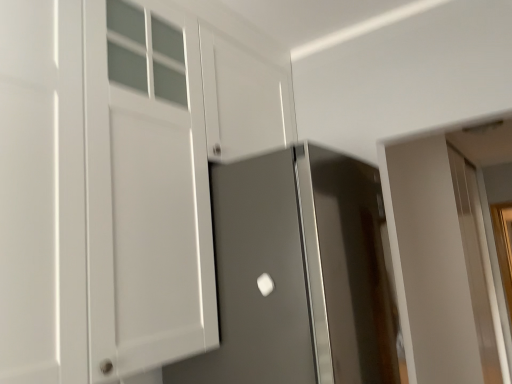
Question: Could you tell me if white matte cabinet at left is turned towards satin gray door at center, positioned as the first door in front-to-back order?

Choices:
 (A) no
 (B) yes

Answer: (A)

Question: Considering the relative sizes of white matte cabinet at left and satin gray door at center, the second door from the right, in the image provided, is white matte cabinet at left wider than satin gray door at center, the second door from the right,?

Choices:
 (A) yes
 (B) no

Answer: (B)

Question: From a real-world perspective, is white matte cabinet at left positioned under satin gray door at center, the second door from the right, based on gravity?

Choices:
 (A) yes
 (B) no

Answer: (B)

Question: Is white matte cabinet at left bigger than satin gray door at center, which is the second door from back to front?

Choices:
 (A) yes
 (B) no

Answer: (B)

Question: From the image's perspective, does white matte cabinet at left appear higher than satin gray door at center, positioned as the first door in front-to-back order?

Choices:
 (A) no
 (B) yes

Answer: (B)

Question: Is white matte cabinet at left located outside satin gray door at center, positioned as the first door in front-to-back order?

Choices:
 (A) yes
 (B) no

Answer: (A)

Question: Is white glossy door at right, which is the second door in front-to-back order, facing away from white matte cabinet at left?

Choices:
 (A) no
 (B) yes

Answer: (A)

Question: Considering the relative sizes of white glossy door at right, the 1th door positioned from the back, and white matte cabinet at left in the image provided, is white glossy door at right, the 1th door positioned from the back, thinner than white matte cabinet at left?

Choices:
 (A) no
 (B) yes

Answer: (A)

Question: Is white glossy door at right, which is the second door in front-to-back order, closer to camera compared to white matte cabinet at left?

Choices:
 (A) no
 (B) yes

Answer: (A)

Question: From the image's perspective, is white glossy door at right, the 1th door positioned from the right, over white matte cabinet at left?

Choices:
 (A) no
 (B) yes

Answer: (A)

Question: From the image's perspective, is white glossy door at right, the 1th door positioned from the back, located beneath white matte cabinet at left?

Choices:
 (A) yes
 (B) no

Answer: (A)

Question: Is white glossy door at right, the 1th door positioned from the back, surrounding white matte cabinet at left?

Choices:
 (A) yes
 (B) no

Answer: (B)

Question: Is white matte cabinet at left at the left side of white glossy door handle at center?

Choices:
 (A) no
 (B) yes

Answer: (B)